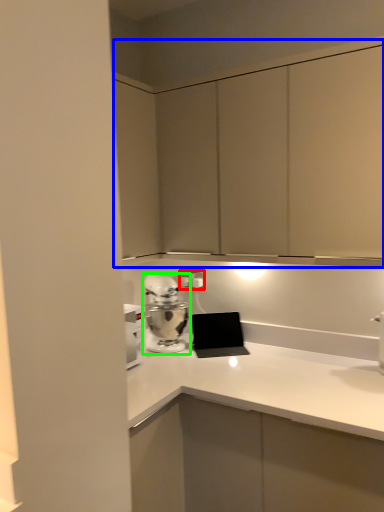
Question: Estimate the real-world distances between objects in this image. Which object is closer to electric outlet (highlighted by a red box), dresser (highlighted by a blue box) or home appliance (highlighted by a green box)?

Choices:
 (A) dresser
 (B) home appliance

Answer: (B)